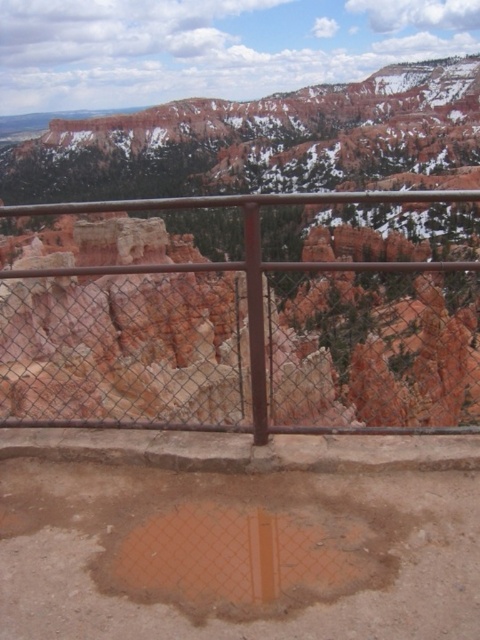
Which is in front, point (166, 230) or point (344, 566)?

Point (344, 566) is more forward.

Does point (41, 324) lie in front of point (256, 588)?

No.

Is point (277, 337) less distant than point (167, 586)?

No, (277, 337) is behind (167, 586).

Locate an element on the screen. rusty metal fence at center is located at coordinates (241, 317).